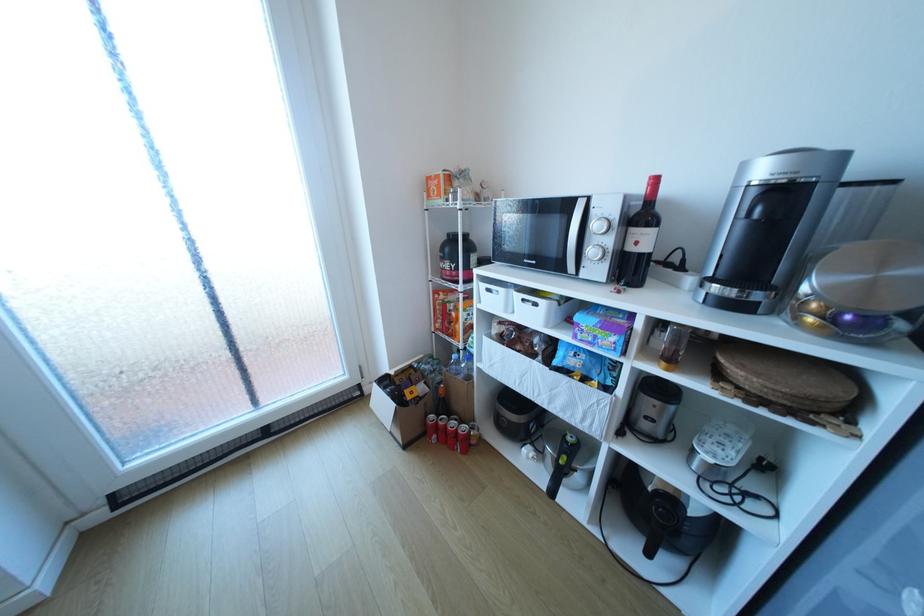
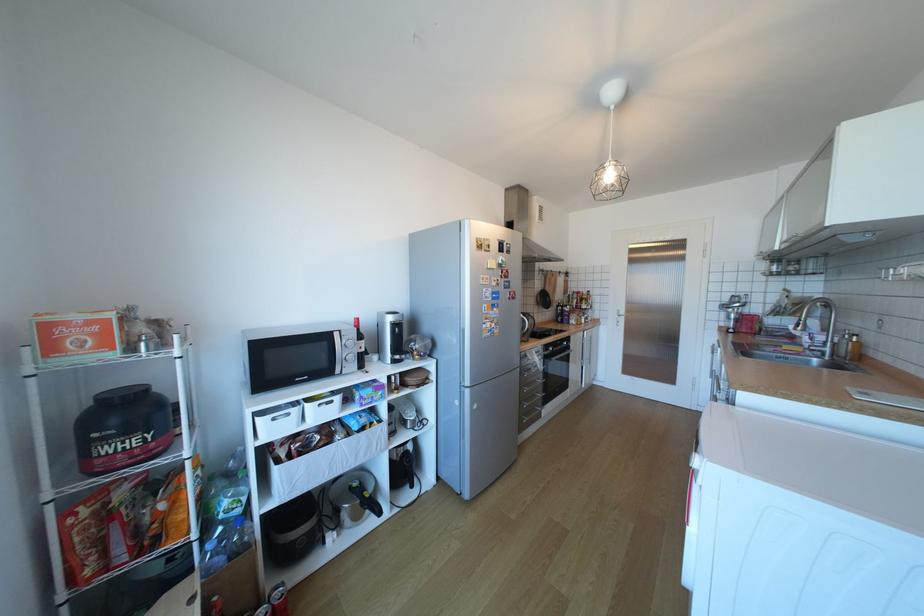
Where in the second image is the point corresponding to [658,554] from the first image?

(420, 485)